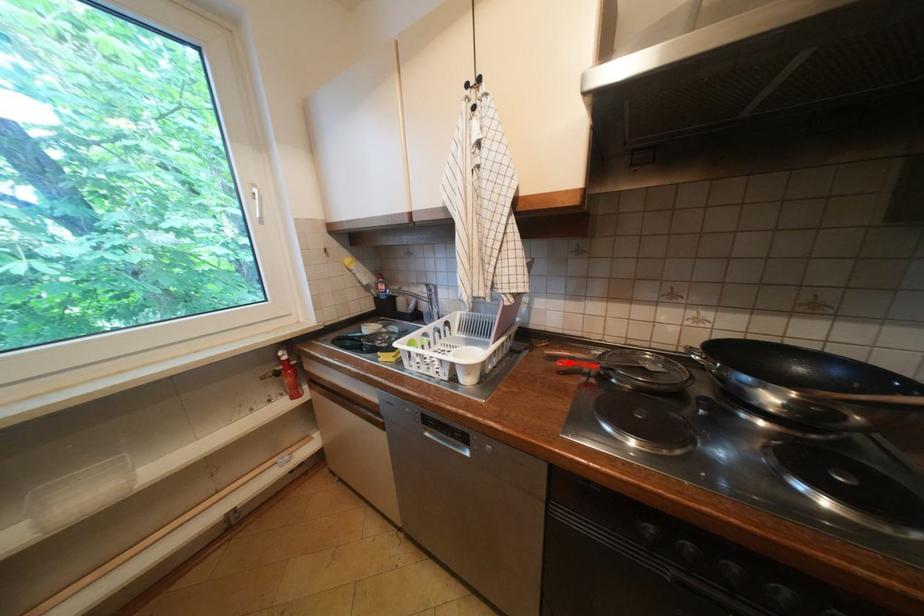
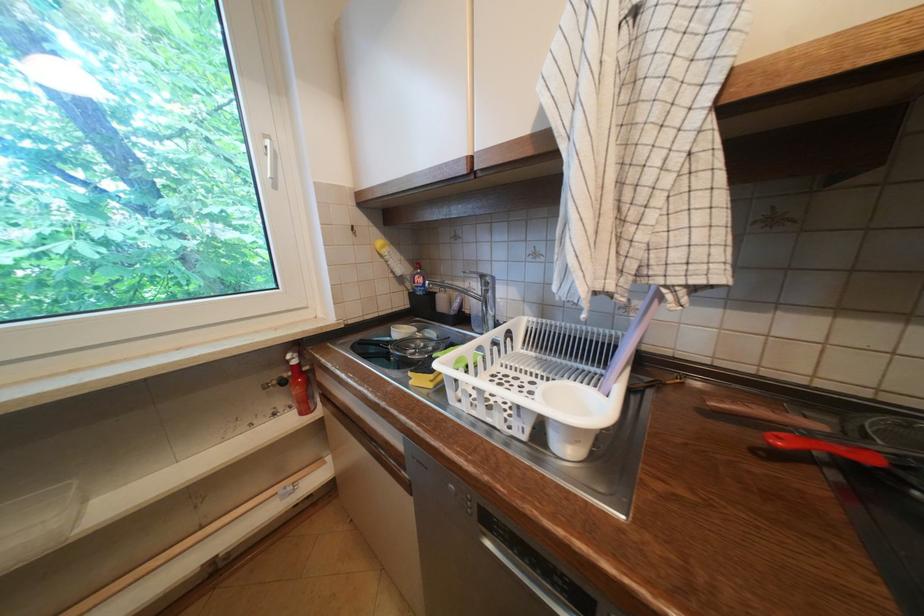
Find the pixel in the second image that matches the highlighted location in the first image.

(788, 440)